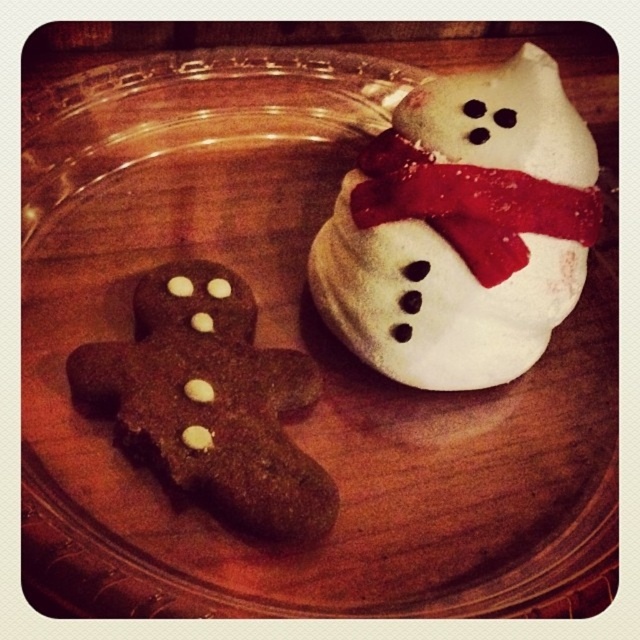
You are standing in a kitchen and see the brown matte gingerbread man at left on a glass plate. If you want to grab the cookie without moving your feet, can you reach it?

The brown matte gingerbread man at left is 3.69 feet away from the viewer, which is approximately 44.28 inches. Since the average human arm length is around 25 to 30 inches, you cannot reach the cookie without moving your feet.

You are a baker who needs to package these cookies and their decorations. You have a small box that can only fit items smaller than the white frosted cookie at upper right. Can the red fabric scarf at upper right fit into the box?

The white frosted cookie at upper right is bigger than the red fabric scarf at upper right, so the red fabric scarf at upper right can fit into the box since it is smaller than the cookie.